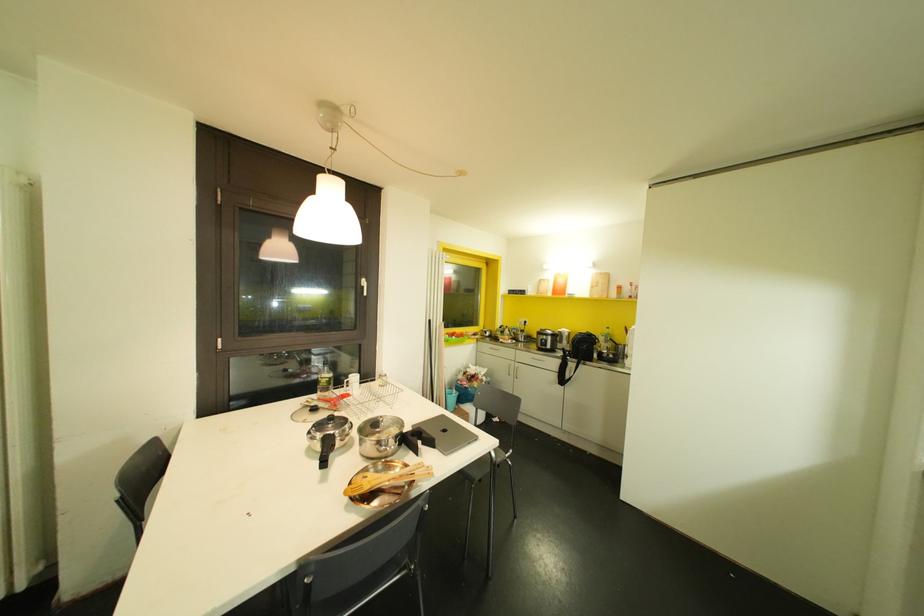
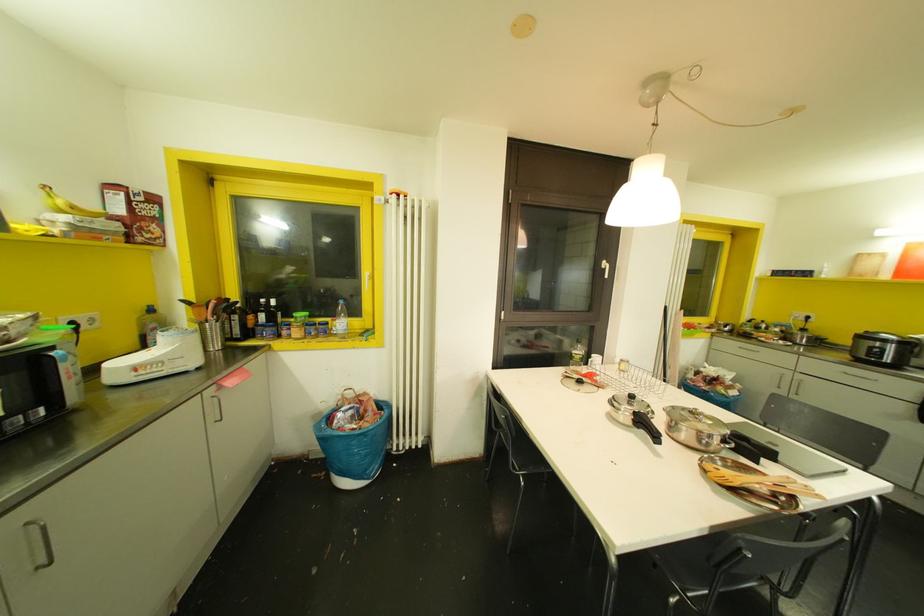
Where in the second image is the point corresponding to (x=516, y=370) from the first image?

(796, 383)